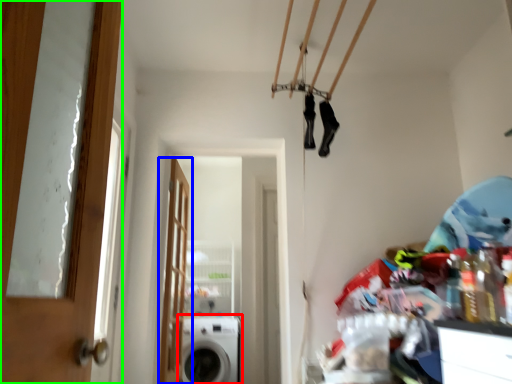
Question: Which object is positioned farthest from washing machine (highlighted by a red box)? Select from door (highlighted by a blue box) and door (highlighted by a green box).

Choices:
 (A) door
 (B) door

Answer: (B)